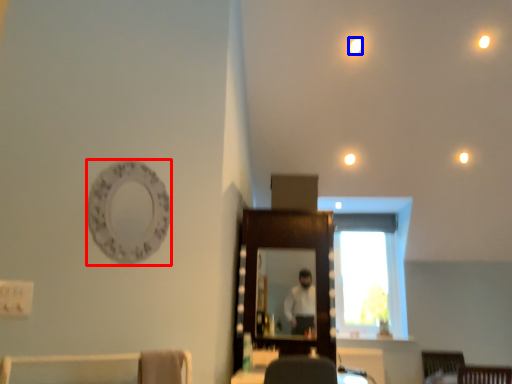
Question: Which object is closer to the camera taking this photo, oval (highlighted by a red box) or lighting (highlighted by a blue box)?

Choices:
 (A) oval
 (B) lighting

Answer: (A)